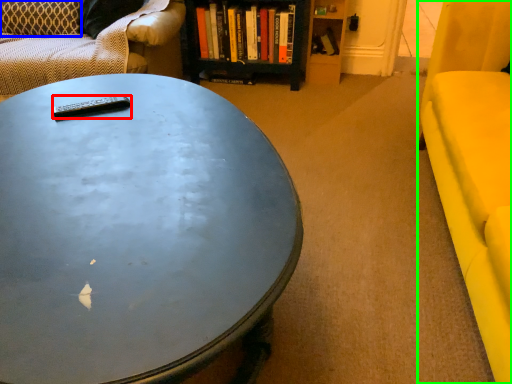
Question: Which object is positioned closest to remote control (highlighted by a red box)? Select from pillow (highlighted by a blue box) and armchair (highlighted by a green box).

Choices:
 (A) pillow
 (B) armchair

Answer: (B)